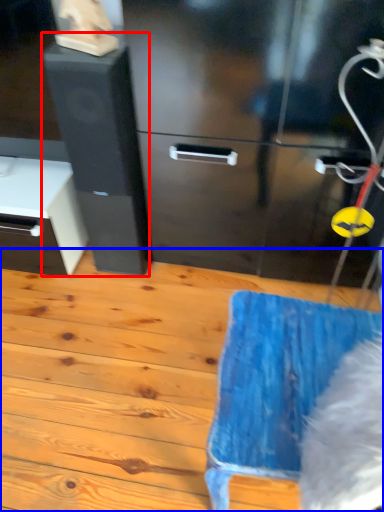
Question: Which object appears farthest to the camera in this image, file cabinet (highlighted by a red box) or wood (highlighted by a blue box)?

Choices:
 (A) file cabinet
 (B) wood

Answer: (A)